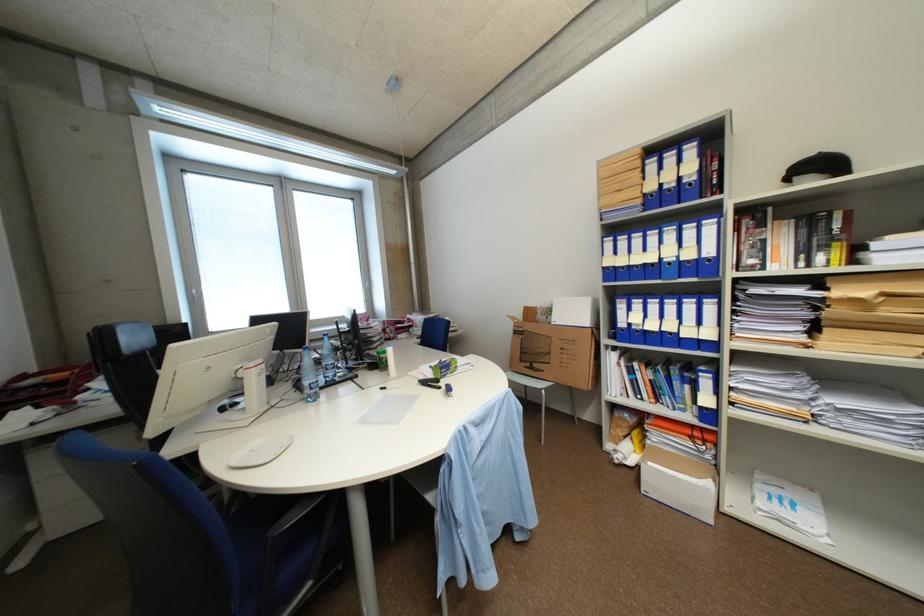
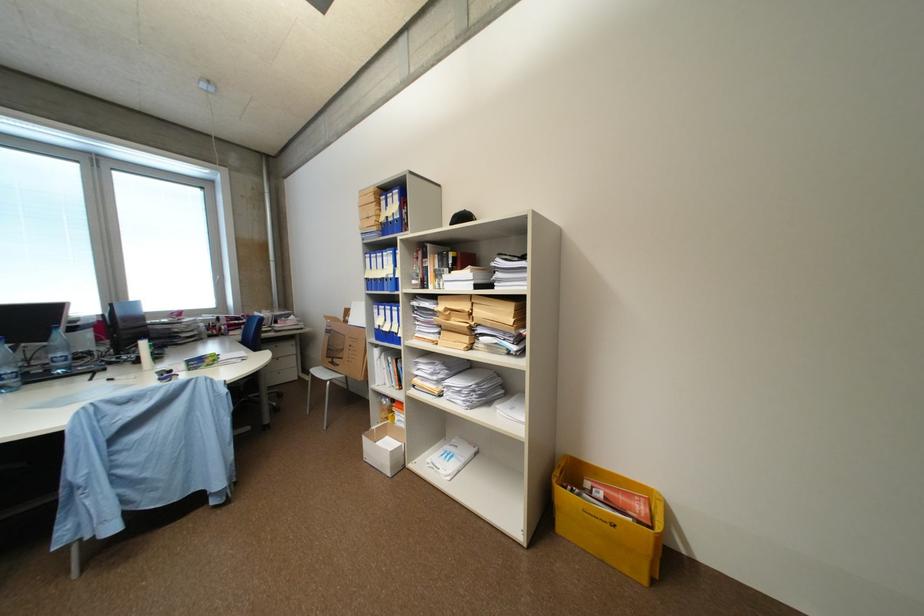
Where in the second image is the point corresponding to point (530, 354) from the first image?

(336, 350)